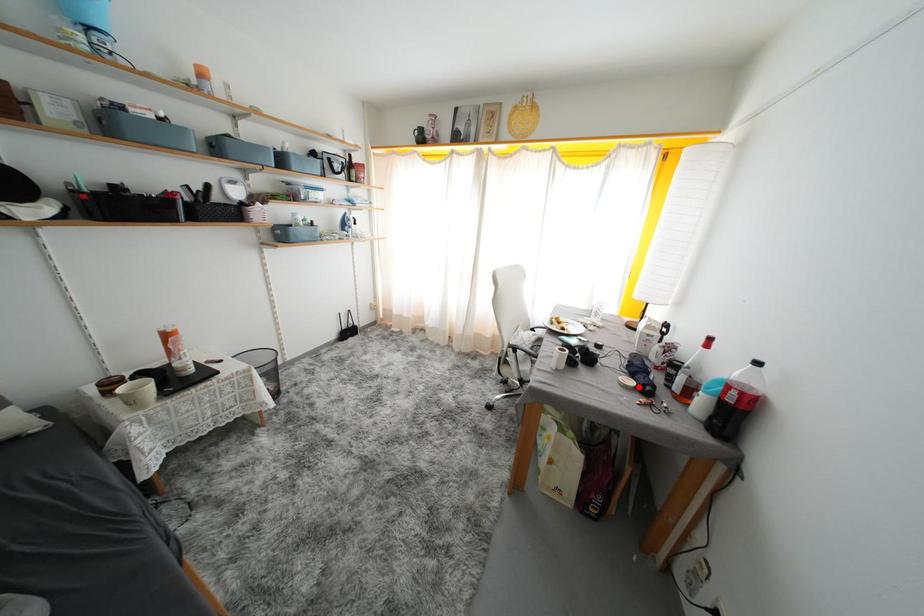
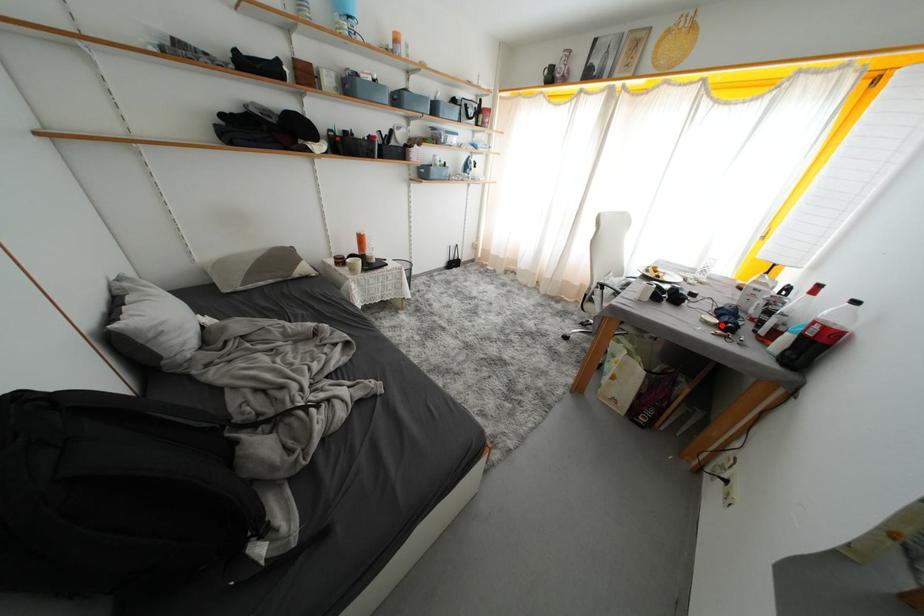
I am providing you with two images of the same scene from different viewpoints. A red point is marked on the first image and another point is marked on the second image. Do the highlighted points in image1 and image2 indicate the same real-world spot?

Yes